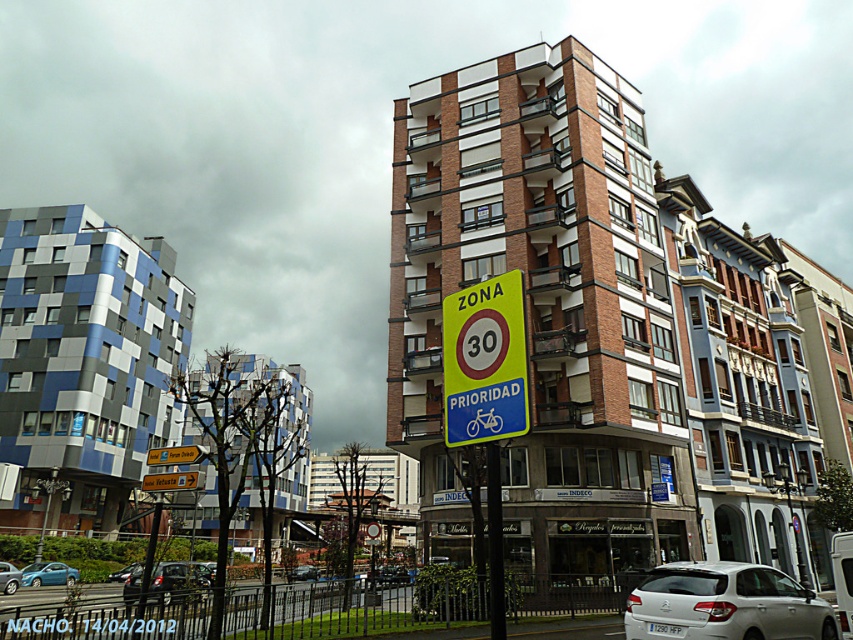
Question: Can you confirm if white matte car at lower right is wider than yellow plastic sign at center?

Choices:
 (A) no
 (B) yes

Answer: (B)

Question: Is matte blue car at center positioned before shiny black sedan at center?

Choices:
 (A) yes
 (B) no

Answer: (A)

Question: Which point is closer to the camera?

Choices:
 (A) metallic blue sedan at center
 (B) metallic silver car at center

Answer: (B)

Question: Considering the relative positions of metallic silver car at lower left and yellow plastic road sign at center in the image provided, where is metallic silver car at lower left located with respect to yellow plastic road sign at center?

Choices:
 (A) above
 (B) below

Answer: (B)

Question: Which point is farther to the camera?

Choices:
 (A) (302, 572)
 (B) (202, 568)
 (C) (129, 568)

Answer: (A)

Question: Which object is farther from the camera taking this photo?

Choices:
 (A) yellow plastic road sign at center
 (B) metallic pole at center

Answer: (A)